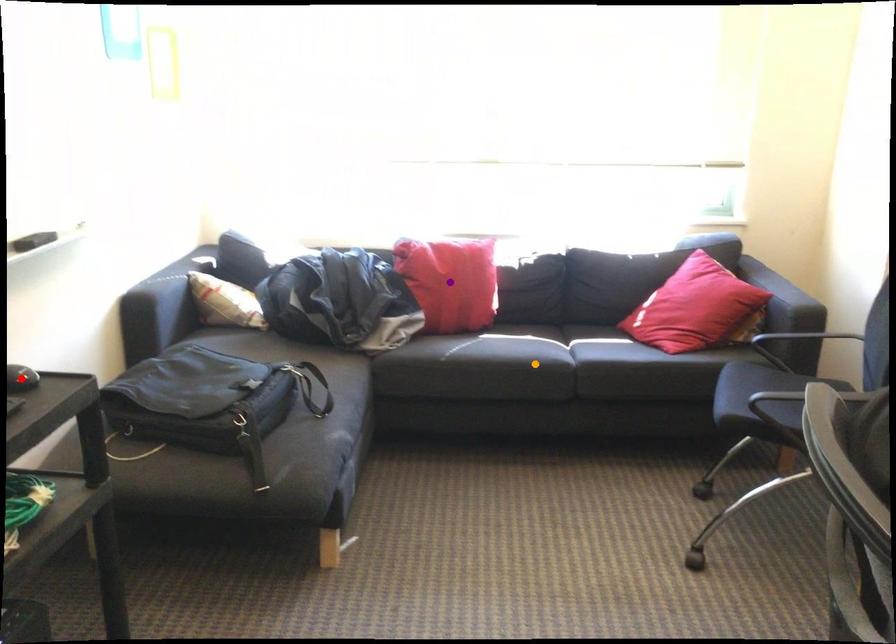
Order these from farthest to nearest:
A) red point
B) orange point
C) purple point

purple point
orange point
red point